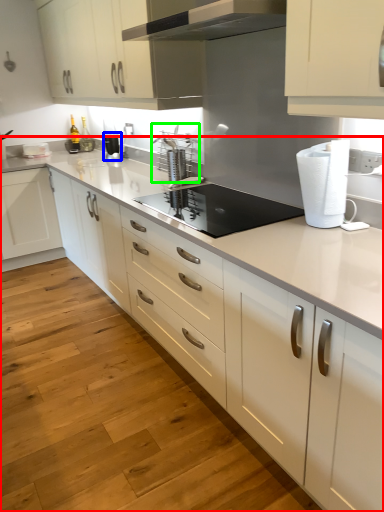
Question: Which object is positioned farthest from countertop (highlighted by a red box)? Select from kitchen appliance (highlighted by a blue box) and appliance (highlighted by a green box).

Choices:
 (A) kitchen appliance
 (B) appliance

Answer: (A)